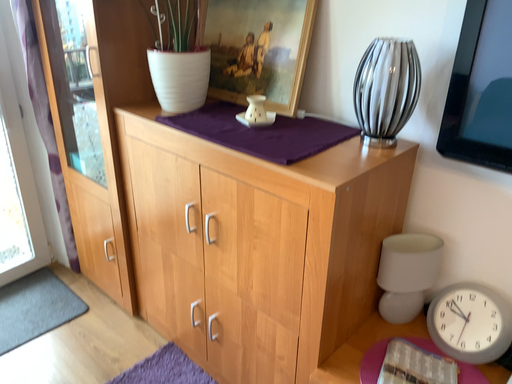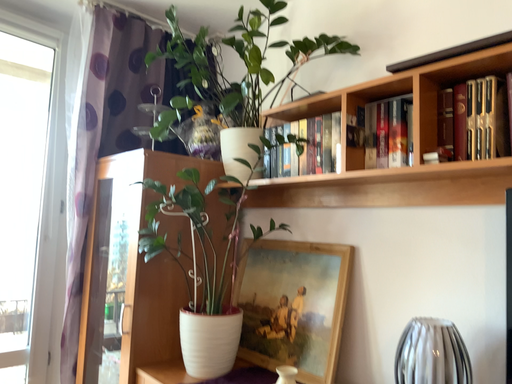
Question: How did the camera likely rotate when shooting the video?

Choices:
 (A) rotated upward
 (B) rotated downward

Answer: (A)